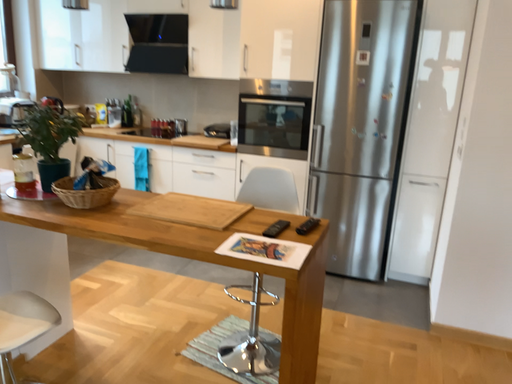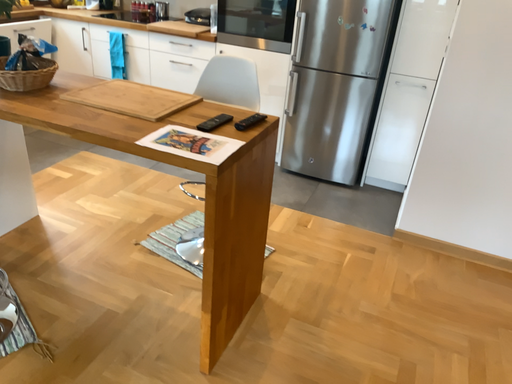
Question: Which way did the camera rotate in the video?

Choices:
 (A) rotated upward
 (B) rotated downward

Answer: (B)